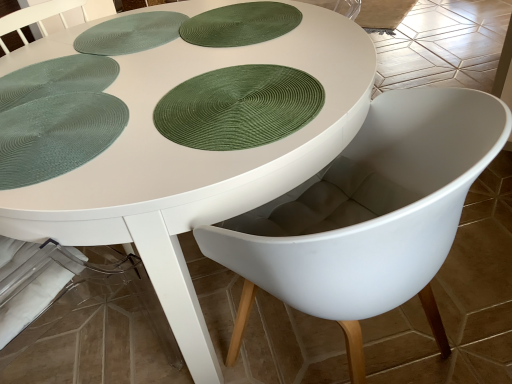
Question: Is the depth of green textured placemat at upper left, which appears as the 3th paper plate when ordered from the bottom, greater than that of white matte poker table at center?

Choices:
 (A) yes
 (B) no

Answer: (B)

Question: Is green textured placemat at upper left, the 2th paper plate when ordered from top to bottom, to the right of white matte poker table at center from the viewer's perspective?

Choices:
 (A) yes
 (B) no

Answer: (B)

Question: Is green textured placemat at upper left, the 2th paper plate when ordered from top to bottom, smaller than white matte poker table at center?

Choices:
 (A) no
 (B) yes

Answer: (B)

Question: Are green textured placemat at upper left, which appears as the 3th paper plate when ordered from the bottom, and white matte poker table at center making contact?

Choices:
 (A) yes
 (B) no

Answer: (B)

Question: Is white matte poker table at center located within green textured placemat at upper left, which appears as the 3th paper plate when ordered from the bottom?

Choices:
 (A) no
 (B) yes

Answer: (A)

Question: Is green textured placemat at upper left, the 2th paper plate when ordered from top to bottom, thinner than white matte poker table at center?

Choices:
 (A) no
 (B) yes

Answer: (B)

Question: Is green textured placemat at left, marked as the fourth paper plate in a top-to-bottom arrangement, closer to the viewer compared to green textured placemat at upper left, the 2th paper plate when ordered from top to bottom?

Choices:
 (A) no
 (B) yes

Answer: (B)

Question: Is green textured placemat at left, marked as the first paper plate in a bottom-to-top arrangement, completely or partially outside of green textured placemat at upper left, the 2th paper plate when ordered from top to bottom?

Choices:
 (A) no
 (B) yes

Answer: (B)

Question: From the image's perspective, is green textured placemat at left, marked as the first paper plate in a bottom-to-top arrangement, located above green textured placemat at upper left, which appears as the 3th paper plate when ordered from the bottom?

Choices:
 (A) yes
 (B) no

Answer: (B)

Question: Does green textured placemat at left, marked as the fourth paper plate in a top-to-bottom arrangement, appear on the left side of green textured placemat at upper left, which appears as the 3th paper plate when ordered from the bottom?

Choices:
 (A) yes
 (B) no

Answer: (B)

Question: Is green textured placemat at left, marked as the fourth paper plate in a top-to-bottom arrangement, smaller than green textured placemat at upper left, which appears as the 3th paper plate when ordered from the bottom?

Choices:
 (A) no
 (B) yes

Answer: (A)

Question: Is green textured placemat at left, marked as the fourth paper plate in a top-to-bottom arrangement, shorter than green textured placemat at upper left, the 2th paper plate when ordered from top to bottom?

Choices:
 (A) no
 (B) yes

Answer: (A)

Question: Is white matte table at center positioned beyond the bounds of green textured placemat at upper left, which appears as the 3th paper plate when ordered from the bottom?

Choices:
 (A) no
 (B) yes

Answer: (B)